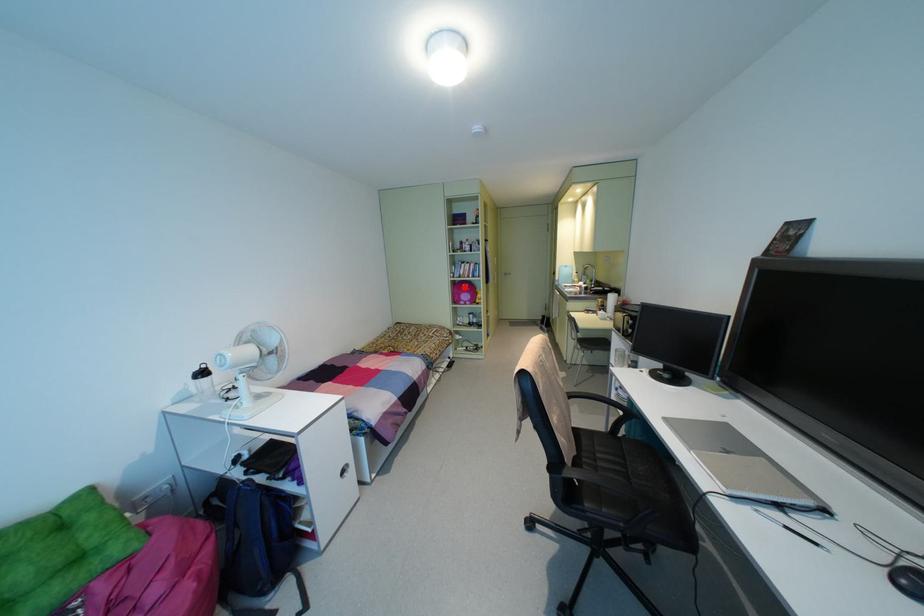
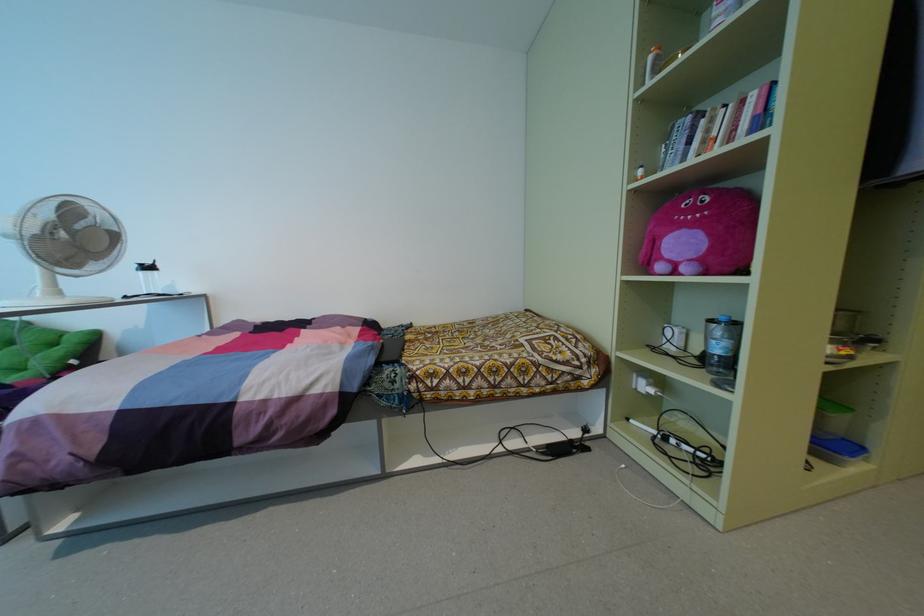
Question: I am providing you with two images of the same scene from different viewpoints. A red point is marked on the first image. At the location where the point appears in image 1, is it still visible in image 2?

Choices:
 (A) Yes
 (B) No

Answer: (A)